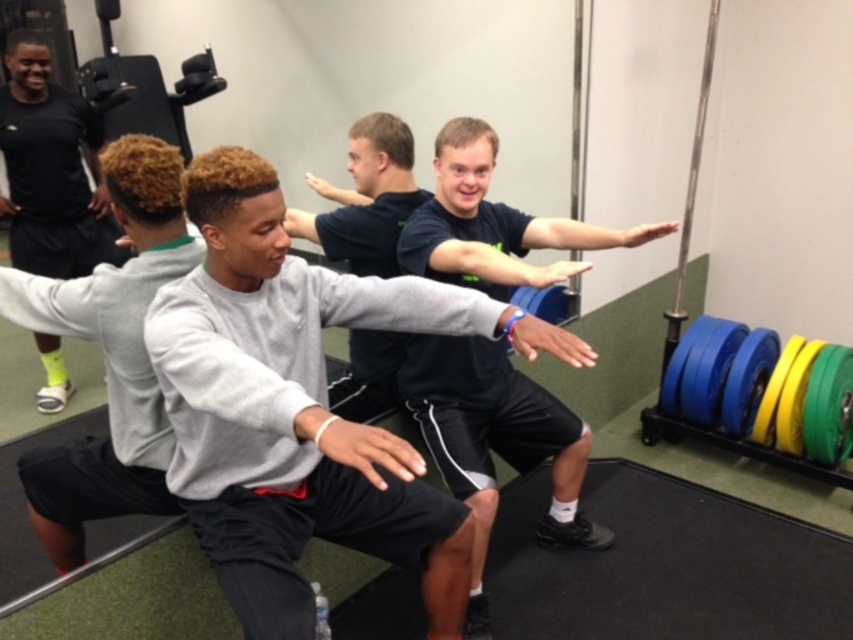
You are a gym instructor observing the group. You notice two participants wearing the gray matte sweatshirt at center and the dark blue shirt at center. From your vantage point, which participant is closer to you?

The gray matte sweatshirt at center is closer to you because it is in front of the dark blue shirt at center.

Based on the coordinates provided, which object is located at point (300, 406) in the gym scene?

The point (300, 406) corresponds to the gray matte sweatshirt at center.